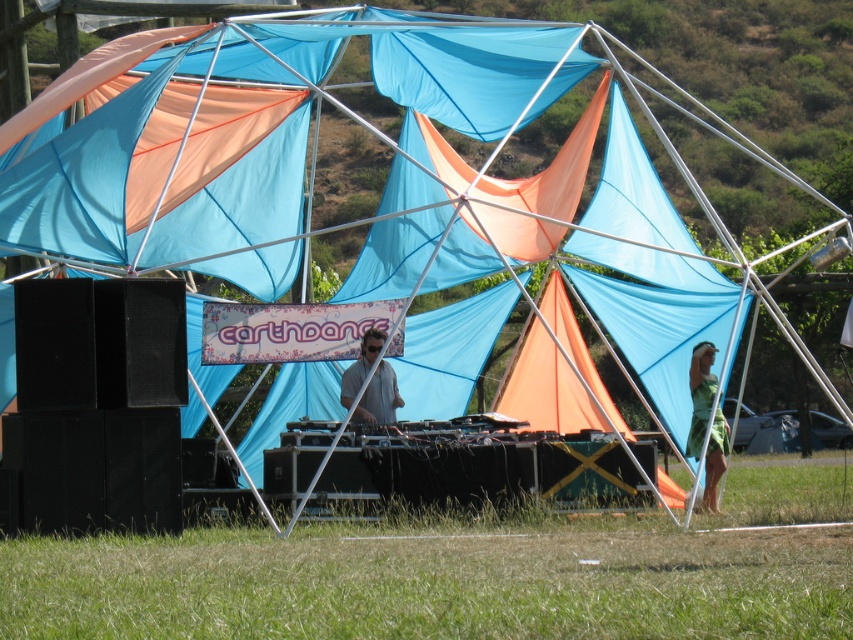
You are a photographer at the event and want to capture both the green fabric dress at right and the matte gray shirt at center in a single shot. Which clothing item will appear taller in the photo?

The green fabric dress at right has a greater height compared to the matte gray shirt at center, so it will appear taller in the photo.

You are attending a music event and see two people. One is wearing a green fabric dress at right and the other is wearing a matte gray shirt at center. From your perspective, which person is standing to the right of the other?

The green fabric dress at right is positioned on the right side of matte gray shirt at center, so the person in the green fabric dress at right is standing to the right of the person in the matte gray shirt at center.

You are attending a music festival and want to find the person in the green fabric dress at right. Based on the scene, where would you look relative to the person wearing the matte gray shirt at center?

The green fabric dress at right is located below the matte gray shirt at center, so you should look downward from the person in the matte gray shirt at center to find the person in the green fabric dress at right.